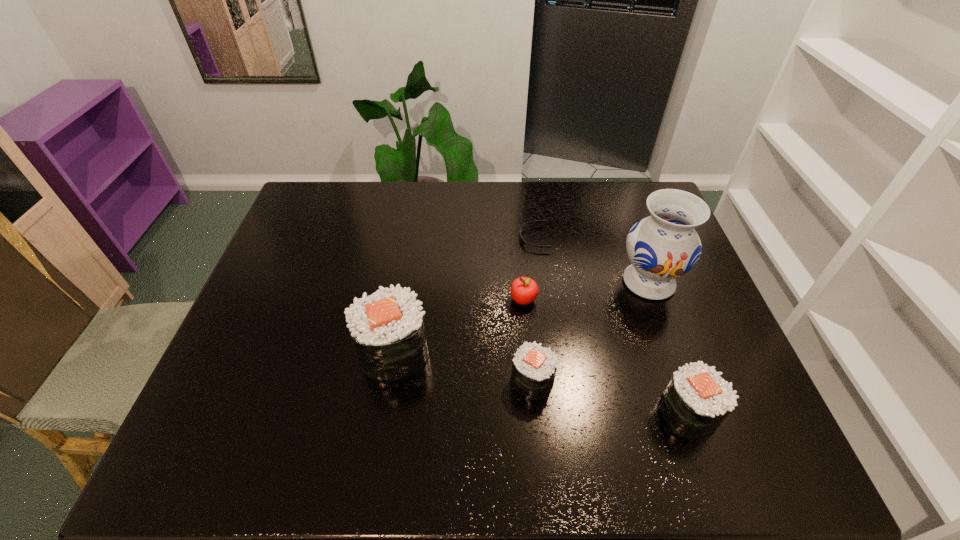
You are a GUI agent. You are given a task and a screenshot of the screen. Output one action in this format:
    pyautogui.click(x=<x>, y=<y>)
    Task: Click on the free space located on the back of the shortest sushi
    Image resolution: width=960 pixels, height=540 pixels.
    Given the screenshot: What is the action you would take?
    pyautogui.click(x=526, y=314)

This screenshot has width=960, height=540. Find the location of `vacant space situated 0.270m on the left of the fourth shortest object`. vacant space situated 0.270m on the left of the fourth shortest object is located at coordinates (539, 413).

Locate an element on the screen. Image resolution: width=960 pixels, height=540 pixels. vacant space located 0.260m on the front-facing side of the shortest object is located at coordinates (438, 238).

This screenshot has width=960, height=540. In order to click on vacant space located on the front-facing side of the shortest object in this screenshot , I will do `click(394, 238)`.

At what (x,y) coordinates should I click in order to perform the action: click on vacant space located 0.160m on the front-facing side of the shortest object. Please return your answer as a coordinate pair (x, y). Looking at the image, I should click on (469, 238).

Find the location of `free space located 0.170m on the front of the tallest object`. free space located 0.170m on the front of the tallest object is located at coordinates (678, 360).

This screenshot has width=960, height=540. In order to click on vacant space located 0.270m on the back of the apple in this screenshot , I will do `click(517, 228)`.

Locate an element on the screen. The image size is (960, 540). sushi that is positioned at the right edge is located at coordinates (697, 399).

Where is `vase that is at the right edge`? vase that is at the right edge is located at coordinates (664, 246).

In order to click on object that is at the near right corner in this screenshot , I will do `click(697, 399)`.